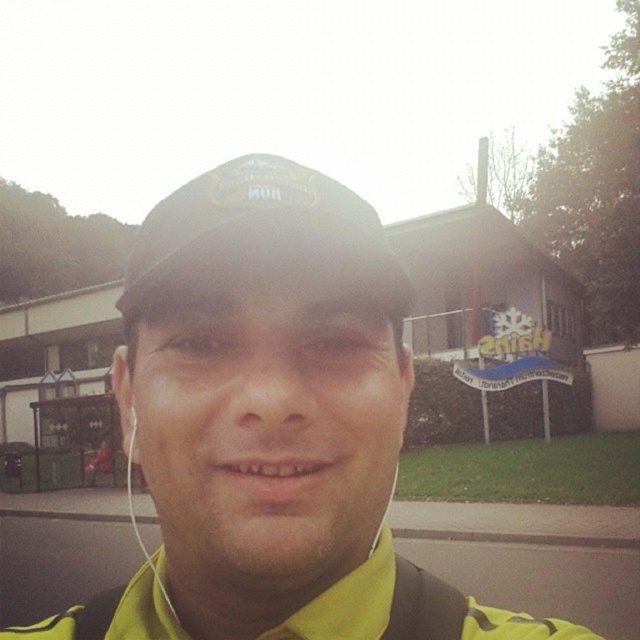
Can you confirm if yellow matte jacket at center is bigger than black fabric cap at center?

Yes.

In order to click on yellow matte jacket at center in this screenshot , I will do `click(269, 420)`.

Image resolution: width=640 pixels, height=640 pixels. Identify the location of yellow matte jacket at center. tap(269, 420).

Does yellow matte jacket at center have a lesser height compared to white earphone at left?

No, yellow matte jacket at center is not shorter than white earphone at left.

Is the position of yellow matte jacket at center less distant than that of white earphone at left?

That is True.

Which is behind, point (284, 216) or point (132, 413)?

Positioned behind is point (132, 413).

At what (x,y) coordinates should I click in order to perform the action: click on yellow matte jacket at center. Please return your answer as a coordinate pair (x, y). This screenshot has height=640, width=640. Looking at the image, I should click on (269, 420).

Between black fabric cap at center and white earphone at left, which one has more height?

black fabric cap at center

Which is more to the right, black fabric cap at center or white earphone at left?

Positioned to the right is black fabric cap at center.

Between point (176, 243) and point (132, 404), which one is positioned in front?

Positioned in front is point (176, 243).

This screenshot has width=640, height=640. What are the coordinates of `black fabric cap at center` in the screenshot? It's located at (248, 212).